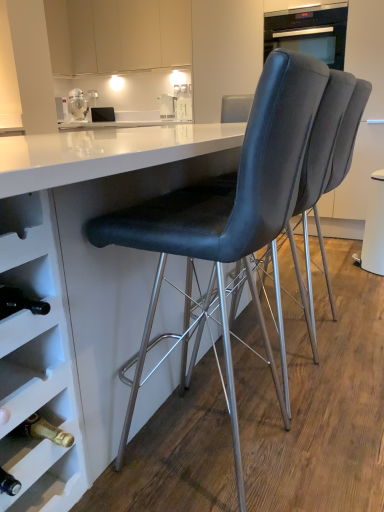
The image size is (384, 512). What do you see at coordinates (24, 246) in the screenshot?
I see `white matte drawer at lower left` at bounding box center [24, 246].

I want to click on matte black chair at center, the 3th chair positioned from the front, so click(x=348, y=134).

What do you see at coordinates (348, 134) in the screenshot? The image size is (384, 512). I see `matte black chair at center, the 3th chair positioned from the front` at bounding box center [348, 134].

What do you see at coordinates (78, 105) in the screenshot? The width and height of the screenshot is (384, 512). I see `metallic silver blender at upper left` at bounding box center [78, 105].

Describe the element at coordinates (117, 35) in the screenshot. I see `matte white cabinets at upper center` at that location.

The width and height of the screenshot is (384, 512). What do you see at coordinates (324, 139) in the screenshot? I see `black leather chair at center, the 2th chair from the back` at bounding box center [324, 139].

This screenshot has height=512, width=384. What are the coordinates of `black glass oven at upper right` in the screenshot? It's located at (309, 32).

In the scene shown: How different are the orientations of black glass oven at upper right and black leather chair at center, marked as the second chair in a front-to-back arrangement, in degrees?

The facing directions of black glass oven at upper right and black leather chair at center, marked as the second chair in a front-to-back arrangement, are 92 degrees apart.

The height and width of the screenshot is (512, 384). I want to click on chair that is the 3rd one below the black glass oven at upper right (from a real-world perspective), so click(x=324, y=139).

Based on their sizes in the image, would you say black glass oven at upper right is bigger or smaller than black leather chair at center, marked as the second chair in a front-to-back arrangement?

In the image, black glass oven at upper right appears to be smaller than black leather chair at center, marked as the second chair in a front-to-back arrangement.

Which object is positioned more to the left, black glass oven at upper right or black leather chair at center, marked as the second chair in a front-to-back arrangement?

black leather chair at center, marked as the second chair in a front-to-back arrangement.

Between black leather chair at center, marked as the second chair in a front-to-back arrangement, and matte black chair at center, which ranks as the third chair in back-to-front order, which one is positioned behind?

black leather chair at center, marked as the second chair in a front-to-back arrangement, is further away from the camera.

Which object is positioned more to the left, black leather chair at center, marked as the second chair in a front-to-back arrangement, or matte black chair at center, which ranks as the third chair in back-to-front order?

Positioned to the left is matte black chair at center, which ranks as the third chair in back-to-front order.

In the scene shown: From a real-world perspective, is black leather chair at center, marked as the second chair in a front-to-back arrangement, physically located above or below matte black chair at center, the 1th chair from the front?

black leather chair at center, marked as the second chair in a front-to-back arrangement, is below matte black chair at center, the 1th chair from the front.

Find the location of `home appliance behind the matte black chair at center, which is counted as the first chair, starting from the back`. home appliance behind the matte black chair at center, which is counted as the first chair, starting from the back is located at coordinates (309, 32).

Consider the image. From a real-world perspective, does matte black chair at center, which is counted as the first chair, starting from the back, stand above black glass oven at upper right?

No.

Which point is more forward, (x=364, y=96) or (x=323, y=51)?

Point (x=364, y=96)

Can you confirm if matte black chair at center, the 3th chair positioned from the front, is wider than black glass oven at upper right?

Correct, the width of matte black chair at center, the 3th chair positioned from the front, exceeds that of black glass oven at upper right.

From the image's perspective, which one is positioned higher, matte black chair at center, which ranks as the third chair in back-to-front order, or matte black chair at center, which is counted as the first chair, starting from the back?

matte black chair at center, which is counted as the first chair, starting from the back, from the image's perspective.

Does matte black chair at center, which ranks as the third chair in back-to-front order, turn towards matte black chair at center, which is counted as the first chair, starting from the back?

No.

Is point (266, 148) positioned before point (341, 181)?

Yes, point (266, 148) is closer to viewer.

Measure the distance between matte black chair at center, the 1th chair from the front, and matte black chair at center, which is counted as the first chair, starting from the back.

matte black chair at center, the 1th chair from the front, and matte black chair at center, which is counted as the first chair, starting from the back, are 23.09 inches apart from each other.

Consider the image. Which is more to the right, matte black chair at center, which ranks as the third chair in back-to-front order, or white matte drawer at lower left?

Positioned to the right is matte black chair at center, which ranks as the third chair in back-to-front order.

Consider the image. Is matte black chair at center, which ranks as the third chair in back-to-front order, far away from white matte drawer at lower left?

That's not correct — matte black chair at center, which ranks as the third chair in back-to-front order, is a little close to white matte drawer at lower left.

Consider the image. Which is closer to the camera, (167, 197) or (3, 242)?

Positioned in front is point (3, 242).

Considering their positions, is matte white cabinets at upper center located in front of or behind metallic silver blender at upper left?

Clearly, matte white cabinets at upper center is in front of metallic silver blender at upper left.

How different are the orientations of matte white cabinets at upper center and metallic silver blender at upper left in degrees?

They differ by 56.5 degrees in their facing directions.

Is matte white cabinets at upper center oriented away from metallic silver blender at upper left?

matte white cabinets at upper center does not have its back to metallic silver blender at upper left.

Looking at their sizes, would you say matte white cabinets at upper center is wider or thinner than metallic silver blender at upper left?

Clearly, matte white cabinets at upper center has more width compared to metallic silver blender at upper left.

Can you confirm if matte white cabinets at upper center is shorter than black glass oven at upper right?

No, matte white cabinets at upper center is not shorter than black glass oven at upper right.

Considering the sizes of objects matte white cabinets at upper center and black glass oven at upper right in the image provided, who is wider, matte white cabinets at upper center or black glass oven at upper right?

black glass oven at upper right is wider.

Does matte white cabinets at upper center have a larger size compared to black glass oven at upper right?

Yes.

Would you say matte white cabinets at upper center is to the left or to the right of black glass oven at upper right in the picture?

From the image, it's evident that matte white cabinets at upper center is to the left of black glass oven at upper right.

In order to click on home appliance above the black leather chair at center, marked as the second chair in a front-to-back arrangement (from a real-world perspective) in this screenshot , I will do `click(309, 32)`.

What are the coordinates of `the 1st chair counting from the right side of the matte black chair at center, which ranks as the third chair in back-to-front order` in the screenshot? It's located at (324, 139).

From the image, which object appears to be farther from black leather chair at center, marked as the second chair in a front-to-back arrangement, matte black chair at center, the 1th chair from the front, or black glass oven at upper right?

black glass oven at upper right is positioned further to the anchor black leather chair at center, marked as the second chair in a front-to-back arrangement.

Consider the image. From the image, which object appears to be nearer to matte black chair at center, which is counted as the first chair, starting from the back, black glass oven at upper right or white matte drawer at lower left?

white matte drawer at lower left lies closer to matte black chair at center, which is counted as the first chair, starting from the back, than the other object.

Which object lies nearer to the anchor point white matte drawer at lower left, matte black chair at center, which is counted as the first chair, starting from the back, or matte black chair at center, the 1th chair from the front?

matte black chair at center, the 1th chair from the front, lies closer to white matte drawer at lower left than the other object.

Based on their spatial positions, is matte black chair at center, which ranks as the third chair in back-to-front order, or black leather chair at center, the 2th chair from the back, further from white glossy table at center?

Based on the image, black leather chair at center, the 2th chair from the back, appears to be further to white glossy table at center.

From the image, which object appears to be nearer to matte black chair at center, which ranks as the third chair in back-to-front order, white matte drawer at lower left or matte white cabinets at upper center?

The object closer to matte black chair at center, which ranks as the third chair in back-to-front order, is white matte drawer at lower left.

From the image, which object appears to be farther from black glass oven at upper right, matte black chair at center, which is counted as the first chair, starting from the back, or matte black chair at center, which ranks as the third chair in back-to-front order?

matte black chair at center, which ranks as the third chair in back-to-front order, is further to black glass oven at upper right.

Based on their spatial positions, is matte white cabinets at upper center or black glass oven at upper right further from white glossy table at center?

Based on the image, matte white cabinets at upper center appears to be further to white glossy table at center.

Which object lies nearer to the anchor point matte black chair at center, the 3th chair positioned from the front, black glass oven at upper right or matte white cabinets at upper center?

black glass oven at upper right is positioned closer to the anchor matte black chair at center, the 3th chair positioned from the front.

Find the location of a particular element. The image size is (384, 512). cabinetry located between white glossy table at center and metallic silver blender at upper left in the depth direction is located at coordinates (117, 35).

Where is `drawer positioned between white glossy table at center and metallic silver blender at upper left from near to far`? Image resolution: width=384 pixels, height=512 pixels. drawer positioned between white glossy table at center and metallic silver blender at upper left from near to far is located at coordinates (24, 246).

This screenshot has width=384, height=512. Find the location of `home appliance positioned between white matte drawer at lower left and matte white cabinets at upper center from near to far`. home appliance positioned between white matte drawer at lower left and matte white cabinets at upper center from near to far is located at coordinates (309, 32).

This screenshot has width=384, height=512. What are the coordinates of `home appliance between black leather chair at center, marked as the second chair in a front-to-back arrangement, and metallic silver blender at upper left, along the z-axis` in the screenshot? It's located at (309, 32).